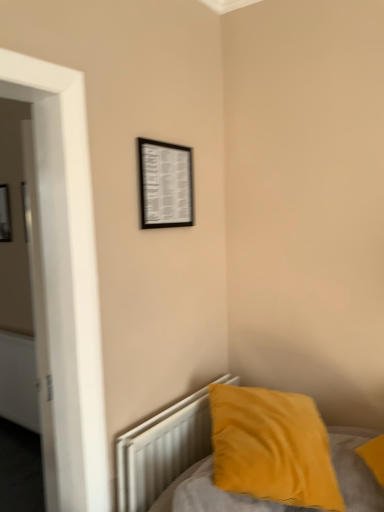
The height and width of the screenshot is (512, 384). What do you see at coordinates (272, 447) in the screenshot?
I see `velvet yellow pillow at lower right` at bounding box center [272, 447].

What is the approximate height of black matte picture frame at upper center, the 1th picture frame in the front-to-back sequence?

The height of black matte picture frame at upper center, the 1th picture frame in the front-to-back sequence, is 13.95 inches.

Measure the distance between point (120, 447) and camera.

Point (120, 447) and camera are 1.47 meters apart.

Where is `velvet yellow pillow at lower right`? The width and height of the screenshot is (384, 512). velvet yellow pillow at lower right is located at coordinates (272, 447).

Is black matte picture frame at upper left, which is the 1th picture frame in back-to-front order, at the back of black matte picture frame at upper center, which ranks as the second picture frame in back-to-front order?

Yes, black matte picture frame at upper center, which ranks as the second picture frame in back-to-front order, is positioned with its back facing black matte picture frame at upper left, which is the 1th picture frame in back-to-front order.

Is black matte picture frame at upper center, acting as the second picture frame starting from the left, in contact with black matte picture frame at upper left, which is the 1th picture frame in back-to-front order?

No, black matte picture frame at upper center, acting as the second picture frame starting from the left, is not touching black matte picture frame at upper left, which is the 1th picture frame in back-to-front order.

Would you say velvet yellow pillow at lower right is inside or outside black matte picture frame at upper left, which is the 1th picture frame in back-to-front order?

velvet yellow pillow at lower right is outside black matte picture frame at upper left, which is the 1th picture frame in back-to-front order.

From the image's perspective, which one is positioned lower, velvet yellow pillow at lower right or black matte picture frame at upper left, which is counted as the 1th picture frame, starting from the left?

velvet yellow pillow at lower right is shown below in the image.

Considering the sizes of velvet yellow pillow at lower right and black matte picture frame at upper left, the second picture frame in the right-to-left sequence, in the image, is velvet yellow pillow at lower right bigger or smaller than black matte picture frame at upper left, the second picture frame in the right-to-left sequence,?

Clearly, velvet yellow pillow at lower right is larger in size than black matte picture frame at upper left, the second picture frame in the right-to-left sequence.

From a real-world perspective, is velvet yellow pillow at lower right positioned above or below black matte picture frame at upper left, which is counted as the 1th picture frame, starting from the left?

In terms of real-world spatial position, velvet yellow pillow at lower right is below black matte picture frame at upper left, which is counted as the 1th picture frame, starting from the left.

At what (x,y) coordinates should I click in order to perform the action: click on picture frame that is the 1st object located above the velvet yellow pillow at lower right (from the image's perspective). Please return your answer as a coordinate pair (x, y). Looking at the image, I should click on (165, 184).

Which is behind, black matte picture frame at upper center, acting as the second picture frame starting from the left, or velvet yellow pillow at lower right?

black matte picture frame at upper center, acting as the second picture frame starting from the left, is further from the camera.

From the image's perspective, which one is positioned lower, black matte picture frame at upper center, acting as the second picture frame starting from the left, or velvet yellow pillow at lower right?

velvet yellow pillow at lower right.

Does black matte picture frame at upper center, which ranks as the second picture frame in back-to-front order, turn towards velvet yellow pillow at lower right?

No, black matte picture frame at upper center, which ranks as the second picture frame in back-to-front order, does not turn towards velvet yellow pillow at lower right.

Is black matte picture frame at upper left, which is counted as the 1th picture frame, starting from the left, directly adjacent to black matte picture frame at upper center, the 1th picture frame in the front-to-back sequence?

They are not placed beside each other.

From a real-world perspective, is black matte picture frame at upper left, which is the 1th picture frame in back-to-front order, beneath black matte picture frame at upper center, which ranks as the second picture frame in back-to-front order?

Correct, in the physical world, black matte picture frame at upper left, which is the 1th picture frame in back-to-front order, is lower than black matte picture frame at upper center, which ranks as the second picture frame in back-to-front order.

Which is behind, black matte picture frame at upper left, the second picture frame in the right-to-left sequence, or black matte picture frame at upper center, which ranks as the second picture frame in back-to-front order?

black matte picture frame at upper left, the second picture frame in the right-to-left sequence.

Considering the positions of objects black matte picture frame at upper left, arranged as the 2th picture frame when viewed from the front, and white metallic radiator at lower right in the image provided, who is in front, black matte picture frame at upper left, arranged as the 2th picture frame when viewed from the front, or white metallic radiator at lower right?

white metallic radiator at lower right.

At what (x,y) coordinates should I click in order to perform the action: click on the 2nd picture frame positioned above the white metallic radiator at lower right (from the image's perspective). Please return your answer as a coordinate pair (x, y). Image resolution: width=384 pixels, height=512 pixels. Looking at the image, I should click on (5, 215).

From a real-world perspective, relative to white metallic radiator at lower right, is black matte picture frame at upper left, the second picture frame in the right-to-left sequence, vertically above or below?

In terms of real-world spatial position, black matte picture frame at upper left, the second picture frame in the right-to-left sequence, is above white metallic radiator at lower right.

Is black matte picture frame at upper left, which is counted as the 1th picture frame, starting from the left, not near white metallic radiator at lower right?

black matte picture frame at upper left, which is counted as the 1th picture frame, starting from the left, is far away from white metallic radiator at lower right.

Identify the location of the 1st picture frame above when counting from the velvet yellow pillow at lower right (from the image's perspective). This screenshot has height=512, width=384. (165, 184).

From a real-world perspective, does velvet yellow pillow at lower right stand above black matte picture frame at upper center, the 1th picture frame in the front-to-back sequence?

No, from a real-world perspective, velvet yellow pillow at lower right is not above black matte picture frame at upper center, the 1th picture frame in the front-to-back sequence.

Could you tell me if velvet yellow pillow at lower right is facing black matte picture frame at upper center, the 1th picture frame in the front-to-back sequence?

No, velvet yellow pillow at lower right is not aimed at black matte picture frame at upper center, the 1th picture frame in the front-to-back sequence.

Is velvet yellow pillow at lower right smaller than black matte picture frame at upper center, which ranks as the second picture frame in back-to-front order?

Actually, velvet yellow pillow at lower right might be larger than black matte picture frame at upper center, which ranks as the second picture frame in back-to-front order.

Does velvet yellow pillow at lower right have a larger size compared to velvet yellow pillow at lower right?

Correct, velvet yellow pillow at lower right is larger in size than velvet yellow pillow at lower right.

Is velvet yellow pillow at lower right aimed at velvet yellow pillow at lower right?

Yes, velvet yellow pillow at lower right is turned towards velvet yellow pillow at lower right.

Is velvet yellow pillow at lower right taller or shorter than velvet yellow pillow at lower right?

In the image, velvet yellow pillow at lower right appears to be taller than velvet yellow pillow at lower right.

Locate an element on the screen. The image size is (384, 512). picture frame located below the black matte picture frame at upper left, which is the 1th picture frame in back-to-front order (from the image's perspective) is located at coordinates (165, 184).

Find the location of a particular element. This screenshot has height=512, width=384. bed to the right of black matte picture frame at upper left, which is the 1th picture frame in back-to-front order is located at coordinates (160, 450).

From the image, which object appears to be nearer to white metallic radiator at lower right, velvet yellow pillow at lower right or velvet yellow pillow at lower right?

velvet yellow pillow at lower right.

Based on their spatial positions, is black matte picture frame at upper center, the 1th picture frame in the front-to-back sequence, or velvet yellow pillow at lower right further from velvet yellow pillow at lower right?

Among the two, black matte picture frame at upper center, the 1th picture frame in the front-to-back sequence, is located further to velvet yellow pillow at lower right.

Looking at the image, which one is located further to velvet yellow pillow at lower right, white metallic radiator at lower right or black matte picture frame at upper center, the 1th picture frame in the front-to-back sequence?

black matte picture frame at upper center, the 1th picture frame in the front-to-back sequence.

Considering their positions, is white metallic radiator at lower right positioned closer to black matte picture frame at upper center, acting as the second picture frame starting from the left, than black matte picture frame at upper left, which is counted as the 1th picture frame, starting from the left?

white metallic radiator at lower right.

From the picture: Looking at the image, which one is located further to velvet yellow pillow at lower right, white metallic radiator at lower right or velvet yellow pillow at lower right?

Based on the image, velvet yellow pillow at lower right appears to be further to velvet yellow pillow at lower right.

Estimate the real-world distances between objects in this image. Which object is further from white metallic radiator at lower right, velvet yellow pillow at lower right or black matte picture frame at upper left, which is counted as the 1th picture frame, starting from the left?

black matte picture frame at upper left, which is counted as the 1th picture frame, starting from the left, is positioned further to the anchor white metallic radiator at lower right.

When comparing their distances from velvet yellow pillow at lower right, does black matte picture frame at upper center, the 1th picture frame in the front-to-back sequence, or white metallic radiator at lower right seem further?

black matte picture frame at upper center, the 1th picture frame in the front-to-back sequence, is further to velvet yellow pillow at lower right.

Based on their spatial positions, is black matte picture frame at upper left, which is counted as the 1th picture frame, starting from the left, or velvet yellow pillow at lower right further from white metallic radiator at lower right?

black matte picture frame at upper left, which is counted as the 1th picture frame, starting from the left.

The width and height of the screenshot is (384, 512). What are the coordinates of `bed between white metallic radiator at lower right and velvet yellow pillow at lower right from left to right` in the screenshot? It's located at (160, 450).

Where is `bed between black matte picture frame at upper center, which ranks as the second picture frame in back-to-front order, and velvet yellow pillow at lower right in the up-down direction`? Image resolution: width=384 pixels, height=512 pixels. bed between black matte picture frame at upper center, which ranks as the second picture frame in back-to-front order, and velvet yellow pillow at lower right in the up-down direction is located at coordinates (160, 450).

Where is `picture frame between velvet yellow pillow at lower right and black matte picture frame at upper left, arranged as the 2th picture frame when viewed from the front, in the front-back direction`? picture frame between velvet yellow pillow at lower right and black matte picture frame at upper left, arranged as the 2th picture frame when viewed from the front, in the front-back direction is located at coordinates (165, 184).

I want to click on radiator between black matte picture frame at upper center, which ranks as the second picture frame in back-to-front order, and velvet yellow pillow at lower right, in the vertical direction, so click(161, 451).